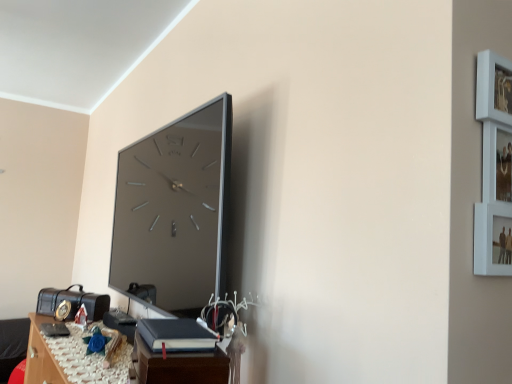
Question: Is point (203, 332) closer or farther from the camera than point (174, 326)?

Choices:
 (A) farther
 (B) closer

Answer: (B)

Question: Looking at the image, does dark brown wood table at lower center, which ranks as the first table in top-to-bottom order, seem bigger or smaller compared to black leather book at lower center?

Choices:
 (A) big
 (B) small

Answer: (A)

Question: Which object is the closest to the dark brown wood table at lower center, which ranks as the first table in top-to-bottom order?

Choices:
 (A) wooden table at lower left, the 2th table in the top-to-bottom sequence
 (B) black leather book at lower center

Answer: (B)

Question: Based on their relative distances, which object is nearer to the black leather book at lower center?

Choices:
 (A) wooden table at lower left, arranged as the first table when ordered from the bottom
 (B) dark brown wood table at lower center, which ranks as the second table in left-to-right order

Answer: (B)